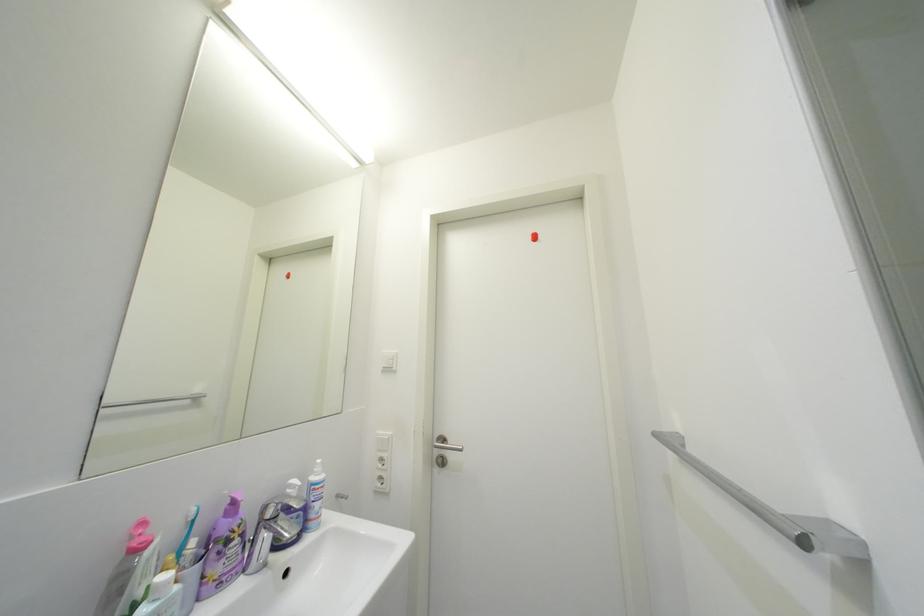
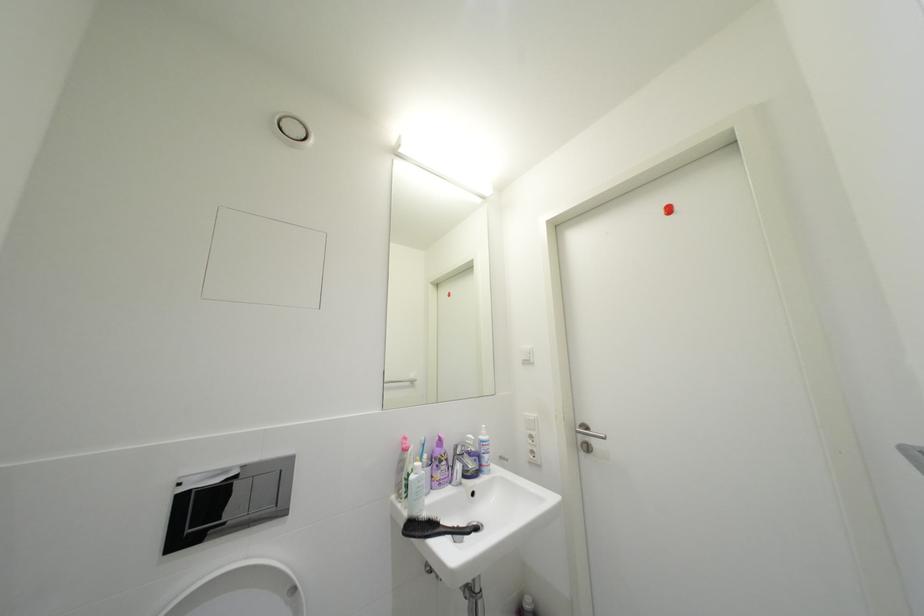
Question: The camera is either moving clockwise (left) or counter-clockwise (right) around the object. The first image is from the beginning of the video and the second image is from the end. Is the camera moving left or right when shooting the video?

Choices:
 (A) Left
 (B) Right

Answer: (B)